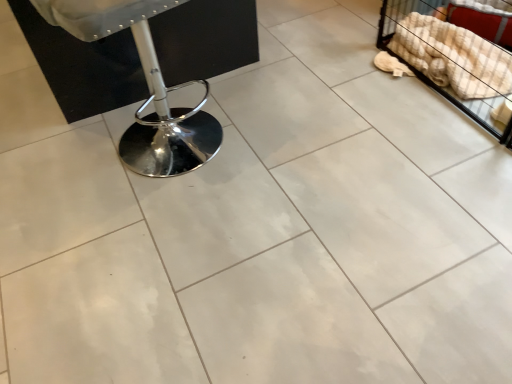
Measure the distance between beige checkered blanket at upper right and camera.

4.94 feet.

What do you see at coordinates (456, 55) in the screenshot? I see `beige checkered blanket at upper right` at bounding box center [456, 55].

Measure the distance between point [418,53] and camera.

The distance of point [418,53] from camera is 1.83 meters.

Identify the location of beige checkered blanket at upper right. (456, 55).

The height and width of the screenshot is (384, 512). Find the location of `chrome metallic swivel chair at left`. chrome metallic swivel chair at left is located at coordinates (148, 87).

The width and height of the screenshot is (512, 384). What do you see at coordinates (148, 87) in the screenshot?
I see `chrome metallic swivel chair at left` at bounding box center [148, 87].

You are a GUI agent. You are given a task and a screenshot of the screen. Output one action in this format:
    pyautogui.click(x=<x>, y=<y>)
    Task: Click on the beige checkered blanket at upper right
    
    Given the screenshot: What is the action you would take?
    point(456,55)

Which is more to the left, beige checkered blanket at upper right or chrome metallic swivel chair at left?

chrome metallic swivel chair at left is more to the left.

Is beige checkered blanket at upper right further to the viewer compared to chrome metallic swivel chair at left?

Yes, it is behind chrome metallic swivel chair at left.

Which point is more distant from viewer, (452, 67) or (138, 134)?

The point (452, 67) is more distant.

From the image's perspective, who appears lower, beige checkered blanket at upper right or chrome metallic swivel chair at left?

chrome metallic swivel chair at left is shown below in the image.

From a real-world perspective, is beige checkered blanket at upper right positioned above or below chrome metallic swivel chair at left?

Clearly, from a real-world perspective, beige checkered blanket at upper right is below chrome metallic swivel chair at left.

Which of these two, beige checkered blanket at upper right or chrome metallic swivel chair at left, is thinner?

Thinner between the two is beige checkered blanket at upper right.

Considering the relative sizes of beige checkered blanket at upper right and chrome metallic swivel chair at left in the image provided, is beige checkered blanket at upper right shorter than chrome metallic swivel chair at left?

Yes, beige checkered blanket at upper right is shorter than chrome metallic swivel chair at left.

Considering the relative sizes of beige checkered blanket at upper right and chrome metallic swivel chair at left in the image provided, is beige checkered blanket at upper right smaller than chrome metallic swivel chair at left?

Yes.

Is beige checkered blanket at upper right surrounding chrome metallic swivel chair at left?

No, chrome metallic swivel chair at left is not inside beige checkered blanket at upper right.

Is beige checkered blanket at upper right far from chrome metallic swivel chair at left?

Yes, beige checkered blanket at upper right is far from chrome metallic swivel chair at left.

Is beige checkered blanket at upper right turned away from chrome metallic swivel chair at left?

No, beige checkered blanket at upper right's orientation is not away from chrome metallic swivel chair at left.

How different are the orientations of beige checkered blanket at upper right and chrome metallic swivel chair at left in degrees?

105 degrees.

How distant is beige checkered blanket at upper right from chrome metallic swivel chair at left?

beige checkered blanket at upper right is 3.46 feet away from chrome metallic swivel chair at left.

Locate an element on the screen. Image resolution: width=512 pixels, height=384 pixels. swivel chair lying below the beige checkered blanket at upper right (from the image's perspective) is located at coordinates (148, 87).

Can you confirm if chrome metallic swivel chair at left is positioned to the left of beige checkered blanket at upper right?

Indeed, chrome metallic swivel chair at left is positioned on the left side of beige checkered blanket at upper right.

Considering their positions, is chrome metallic swivel chair at left located in front of or behind beige checkered blanket at upper right?

In the image, chrome metallic swivel chair at left appears in front of beige checkered blanket at upper right.

Which point is more forward, (182, 128) or (457, 75)?

The point (182, 128) is closer to the camera.

From the image's perspective, which object appears higher, chrome metallic swivel chair at left or beige checkered blanket at upper right?

beige checkered blanket at upper right, from the image's perspective.

From a real-world perspective, does chrome metallic swivel chair at left stand above beige checkered blanket at upper right?

Yes, from a real-world perspective, chrome metallic swivel chair at left is on top of beige checkered blanket at upper right.

From the picture: Considering the relative sizes of chrome metallic swivel chair at left and beige checkered blanket at upper right in the image provided, is chrome metallic swivel chair at left wider than beige checkered blanket at upper right?

Indeed, chrome metallic swivel chair at left has a greater width compared to beige checkered blanket at upper right.

Is chrome metallic swivel chair at left shorter than beige checkered blanket at upper right?

No.

Can you confirm if chrome metallic swivel chair at left is bigger than beige checkered blanket at upper right?

Yes.

Is chrome metallic swivel chair at left outside of beige checkered blanket at upper right?

Indeed, chrome metallic swivel chair at left is completely outside beige checkered blanket at upper right.

Consider the image. Is chrome metallic swivel chair at left directly adjacent to beige checkered blanket at upper right?

No, chrome metallic swivel chair at left is not beside beige checkered blanket at upper right.

Does chrome metallic swivel chair at left turn towards beige checkered blanket at upper right?

No, chrome metallic swivel chair at left is not facing towards beige checkered blanket at upper right.

How different are the orientations of chrome metallic swivel chair at left and beige checkered blanket at upper right in degrees?

105 degrees.

Find the location of `furniture on the right of chrome metallic swivel chair at left`. furniture on the right of chrome metallic swivel chair at left is located at coordinates (456, 55).

In the image, there is a chrome metallic swivel chair at left. Identify the location of furniture above it (from the image's perspective). (456, 55).

The width and height of the screenshot is (512, 384). In the image, there is a chrome metallic swivel chair at left. In order to click on furniture below it (from a real-world perspective) in this screenshot , I will do `click(456, 55)`.